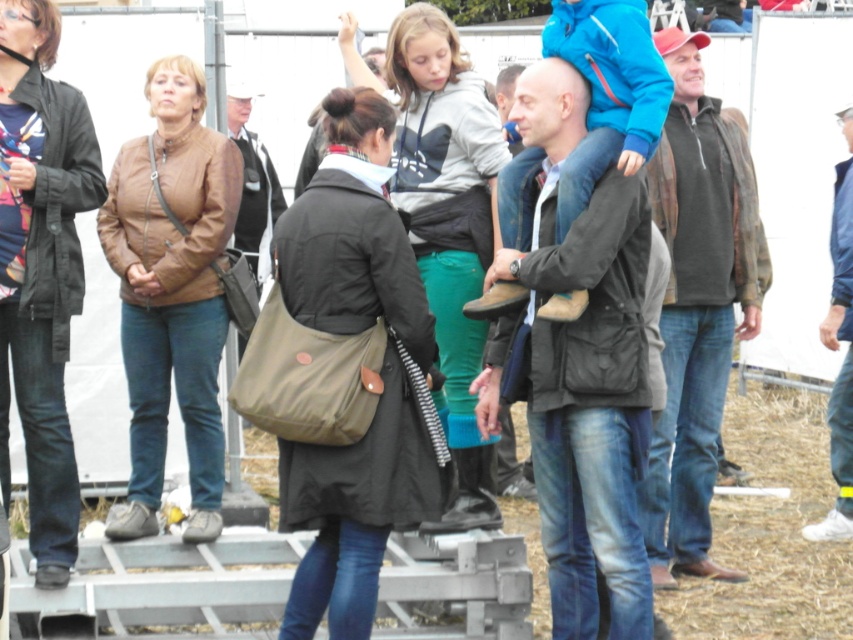
Does olive green fabric bag at center have a smaller size compared to dark gray jacket at center?

Yes.

Is olive green fabric bag at center shorter than dark gray jacket at center?

Yes.

Which is in front, point (412, 426) or point (583, 440)?

Positioned in front is point (583, 440).

This screenshot has width=853, height=640. What are the coordinates of `olive green fabric bag at center` in the screenshot? It's located at (376, 371).

Can you confirm if olive green fabric bag at center is shorter than matte black jacket at lower left?

Indeed, olive green fabric bag at center has a lesser height compared to matte black jacket at lower left.

Is point (375, 467) positioned before point (28, 67)?

Yes, point (375, 467) is closer to viewer.

The width and height of the screenshot is (853, 640). What are the coordinates of `olive green fabric bag at center` in the screenshot? It's located at (376, 371).

From the picture: Is brown leather jacket at center closer to camera compared to gray hoodie at center?

No, it is not.

Can you confirm if brown leather jacket at center is positioned to the left of gray hoodie at center?

Incorrect, brown leather jacket at center is not on the left side of gray hoodie at center.

You are a GUI agent. You are given a task and a screenshot of the screen. Output one action in this format:
    pyautogui.click(x=<x>, y=<y>)
    Task: Click on the brown leather jacket at center
    
    Given the screenshot: What is the action you would take?
    pyautogui.click(x=697, y=305)